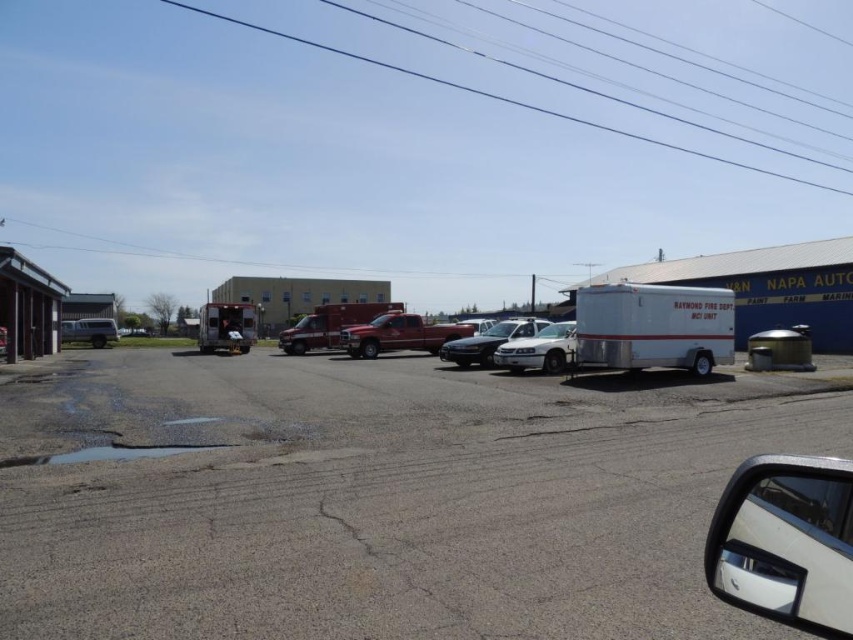
Question: Which object is the closest to the gray asphalt parking lot at center?

Choices:
 (A) white glossy sedan at center
 (B) white glossy ambulance at center

Answer: (A)

Question: Does white matte trailer at right appear over white glossy ambulance at center?

Choices:
 (A) yes
 (B) no

Answer: (A)

Question: Can you confirm if gray asphalt parking lot at center is thinner than white glossy sedan at center?

Choices:
 (A) no
 (B) yes

Answer: (A)

Question: Which point appears farthest from the camera in this image?

Choices:
 (A) (354, 324)
 (B) (682, 362)

Answer: (A)

Question: Can you confirm if shiny red fire truck at center is positioned to the right of white glossy ambulance at center?

Choices:
 (A) no
 (B) yes

Answer: (A)

Question: Which point is closer to the camera taking this photo?

Choices:
 (A) (527, 324)
 (B) (318, 337)

Answer: (A)